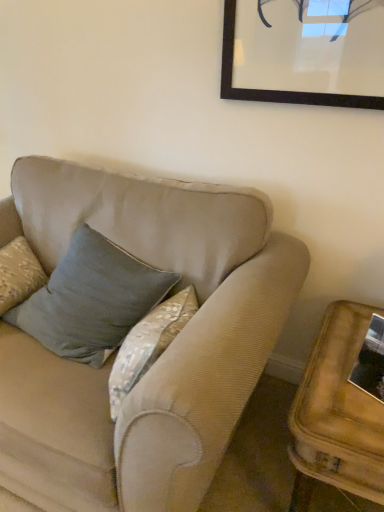
The width and height of the screenshot is (384, 512). I want to click on free point behind metallic reflective frame at lower right, so click(341, 339).